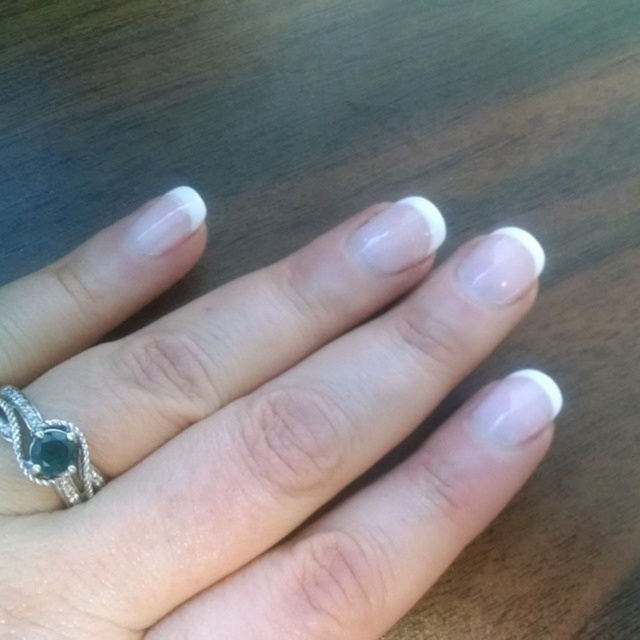
Describe the element at coordinates (260, 428) in the screenshot. I see `white glossy nails at center` at that location.

Identify the location of white glossy nails at center. This screenshot has height=640, width=640. (260, 428).